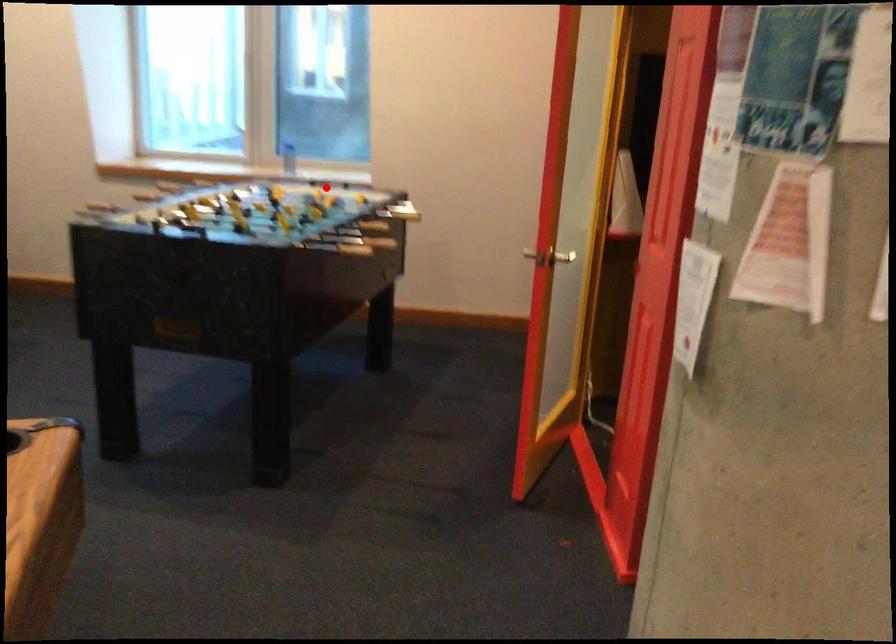
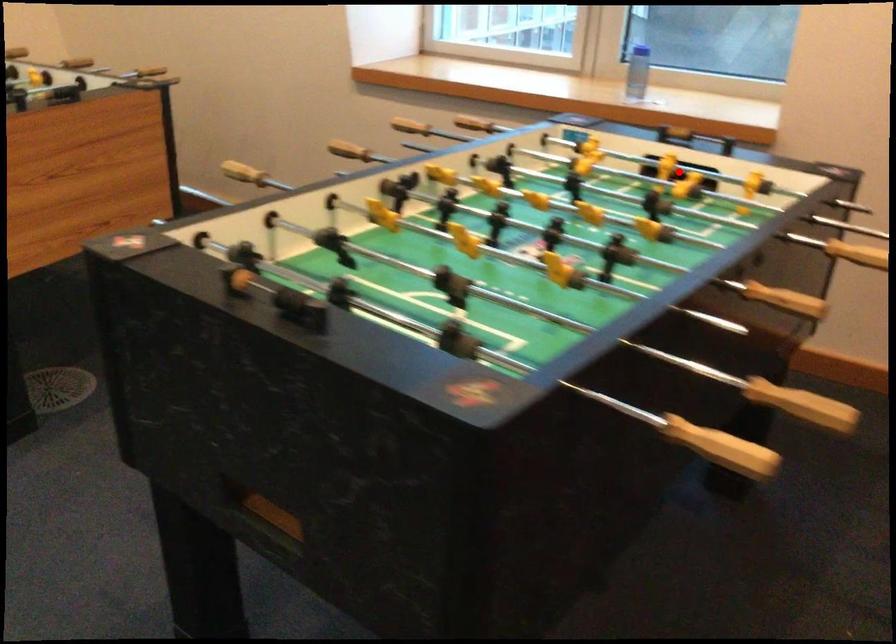
I am providing you with two images of the same scene from different viewpoints. A red point is marked on the first image and another point is marked on the second image. Is the marked point in image1 the same physical position as the marked point in image2?

Yes